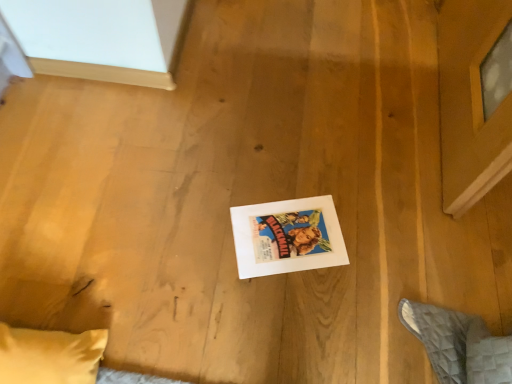
I want to click on vacant area that is in front of white paper at center, so click(x=288, y=321).